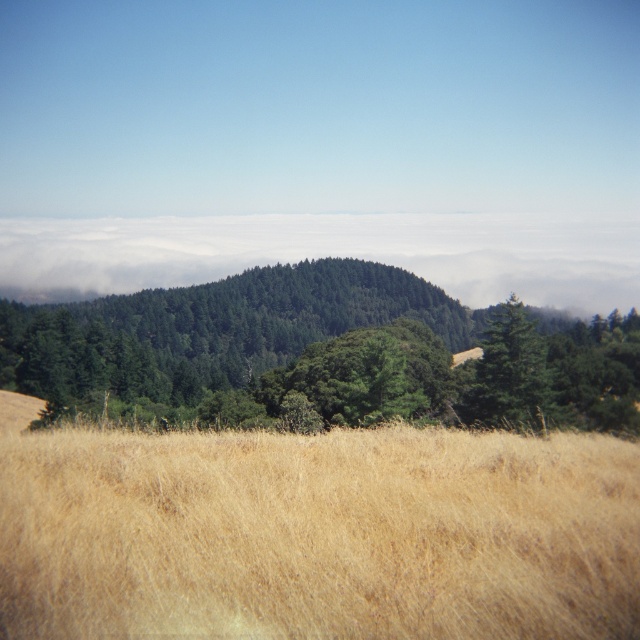
You are standing at the base of the hill and want to reach the point marked by point (134,573) and point (544,401). Which point is closer to you?

Point (134,573) is closer to the viewer than point (544,401), so you will reach point (134,573) first.

You are standing at the bottom of the hill and see the dry grass at lower center and the green matte tree at center. Which object is closer to you?

The dry grass at lower center is closer to you because it is positioned under the green matte tree at center, indicating it is in the foreground.